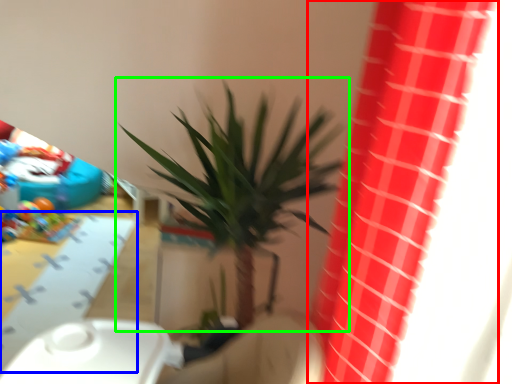
Question: Which object is positioned farthest from curtain (highlighted by a red box)? Select from table (highlighted by a blue box) and houseplant (highlighted by a green box).

Choices:
 (A) table
 (B) houseplant

Answer: (A)